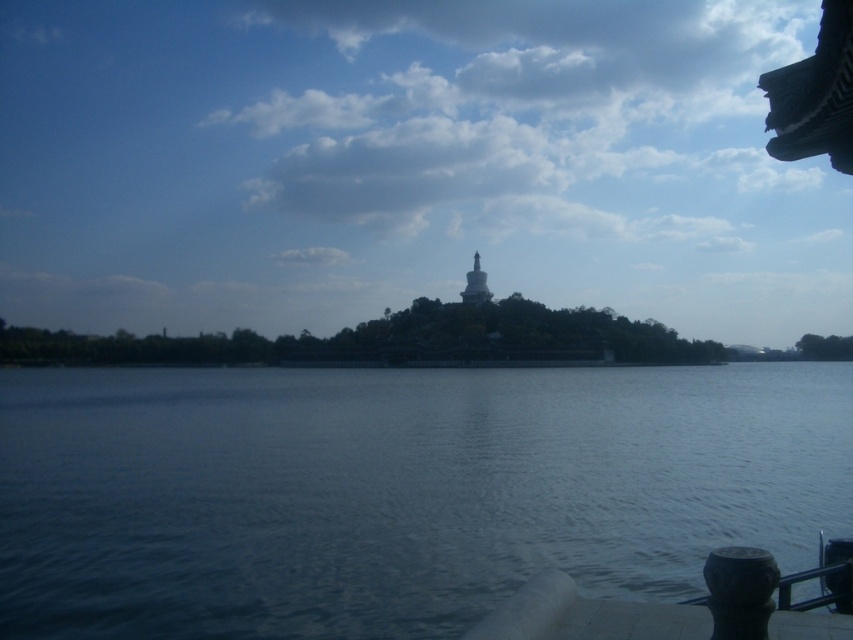
Question: Which point is farther to the camera?

Choices:
 (A) dark blue water at center
 (B) white glossy tower at center

Answer: (B)

Question: Observing the image, what is the correct spatial positioning of dark blue water at center in reference to white glossy tower at center?

Choices:
 (A) right
 (B) left

Answer: (B)

Question: Can you confirm if dark blue water at center is smaller than white glossy tower at center?

Choices:
 (A) no
 (B) yes

Answer: (A)

Question: Is dark blue water at center below white glossy tower at center?

Choices:
 (A) yes
 (B) no

Answer: (A)